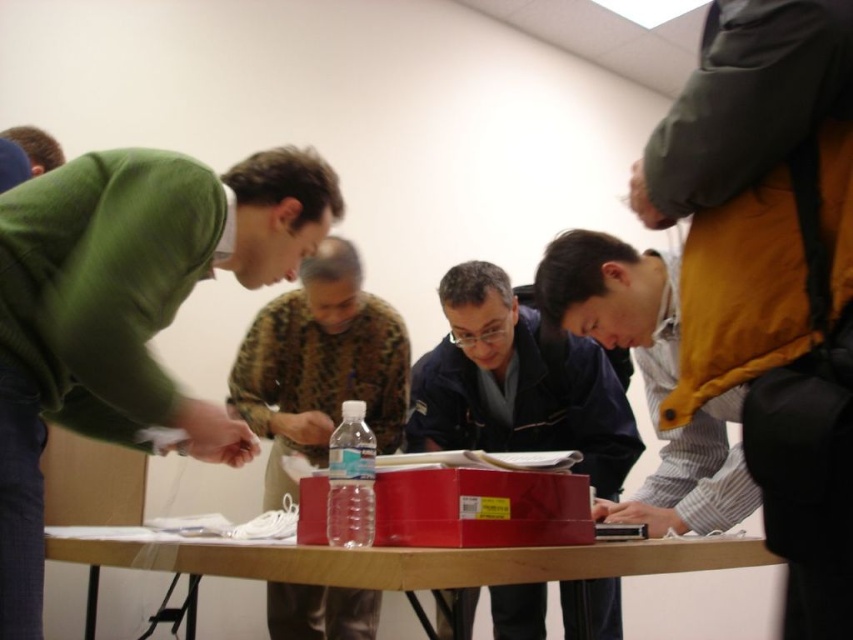
Describe the element at coordinates (517, 381) in the screenshot. I see `matte black jacket at center` at that location.

Can you confirm if matte black jacket at center is smaller than camouflage fabric shirt at center?

No.

The width and height of the screenshot is (853, 640). I want to click on matte black jacket at center, so click(x=517, y=381).

Between green matte sweater at left and clear plastic bottle at center, which one appears on the right side from the viewer's perspective?

clear plastic bottle at center

Find the location of a particular element. green matte sweater at left is located at coordinates (126, 310).

Does point (207, 211) come farther from viewer compared to point (370, 515)?

Yes.

Locate an element on the screen. The image size is (853, 640). green matte sweater at left is located at coordinates (126, 310).

Who is positioned more to the right, wooden table at center or clear plastic bottle at center?

clear plastic bottle at center

What do you see at coordinates (395, 561) in the screenshot? I see `wooden table at center` at bounding box center [395, 561].

Which is behind, point (582, 560) or point (351, 417)?

The point (351, 417) is more distant.

You are a GUI agent. You are given a task and a screenshot of the screen. Output one action in this format:
    pyautogui.click(x=<x>, y=<y>)
    Task: Click on the wooden table at center
    This screenshot has width=853, height=640.
    Given the screenshot: What is the action you would take?
    pyautogui.click(x=395, y=561)